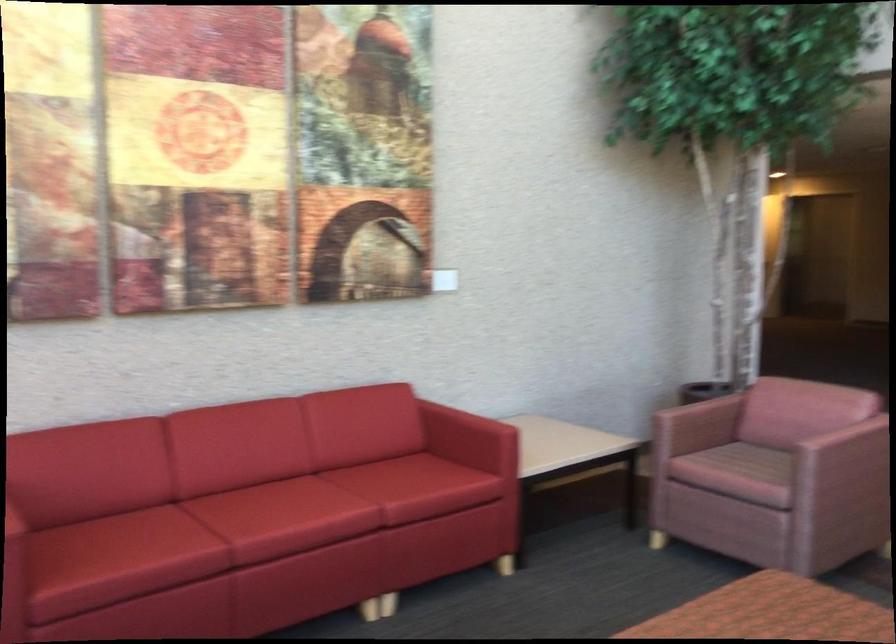
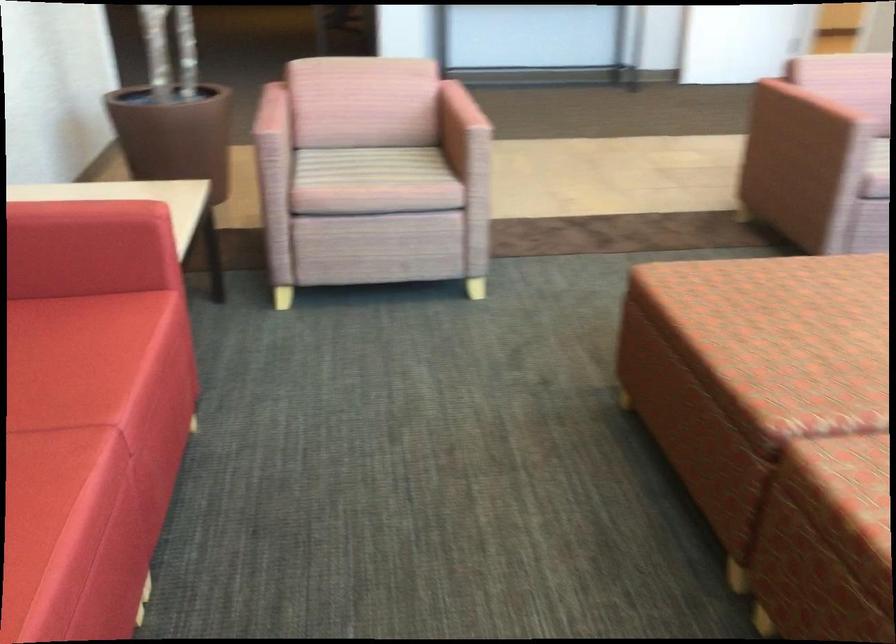
In the second image, find the point that corresponds to (414,478) in the first image.

(69, 360)